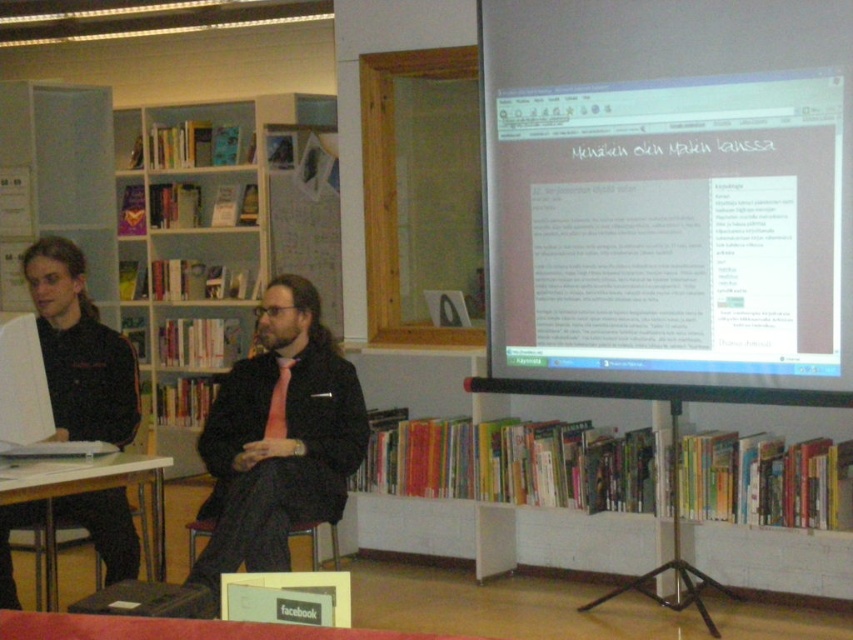
Question: Estimate the real-world distances between objects in this image. Which object is farther from the pink silk tie at center?

Choices:
 (A) white plastic table at lower left
 (B) matte black suit at center
 (C) white glossy projector screen at upper right

Answer: (C)

Question: Can you confirm if white plastic table at lower left is positioned above pink silk tie at center?

Choices:
 (A) no
 (B) yes

Answer: (A)

Question: Which point is farther to the camera?

Choices:
 (A) white wooden bookshelf at left
 (B) white plastic table at lower left

Answer: (A)

Question: Which point is closer to the camera?

Choices:
 (A) (221, 237)
 (B) (247, 540)

Answer: (B)

Question: Is white plastic table at lower left above pink silk tie at center?

Choices:
 (A) no
 (B) yes

Answer: (A)

Question: Is white glossy projector screen at upper right bigger than matte black suit at center?

Choices:
 (A) no
 (B) yes

Answer: (B)